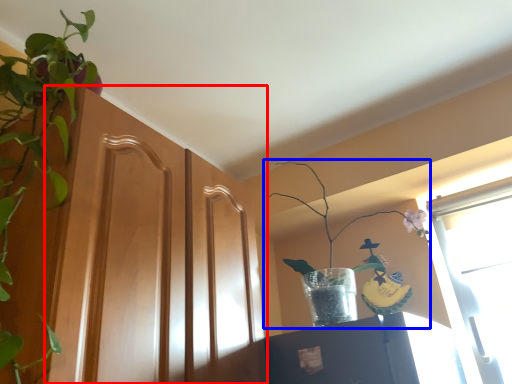
Question: Which of the following is the closest to the observer, screen door (highlighted by a red box) or houseplant (highlighted by a blue box)?

Choices:
 (A) screen door
 (B) houseplant

Answer: (A)